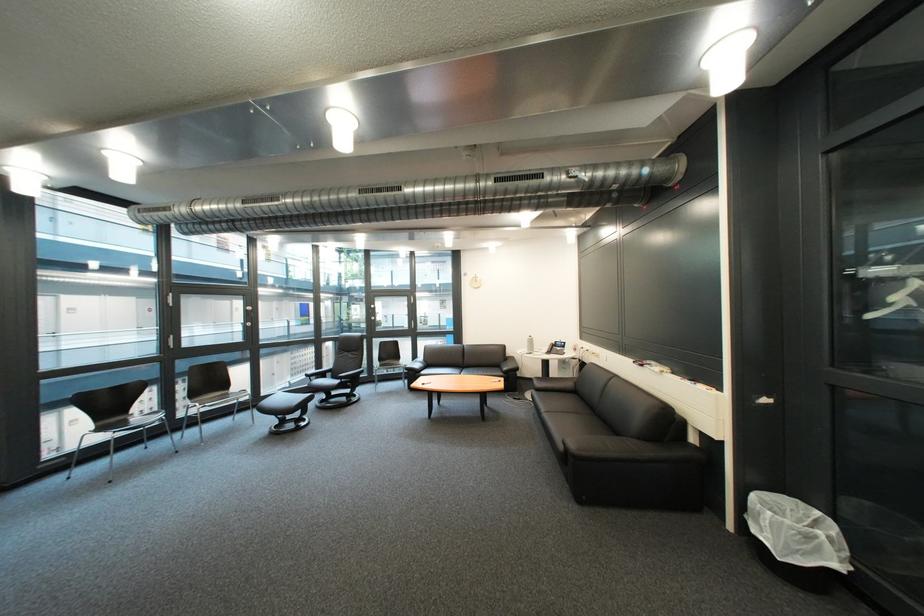
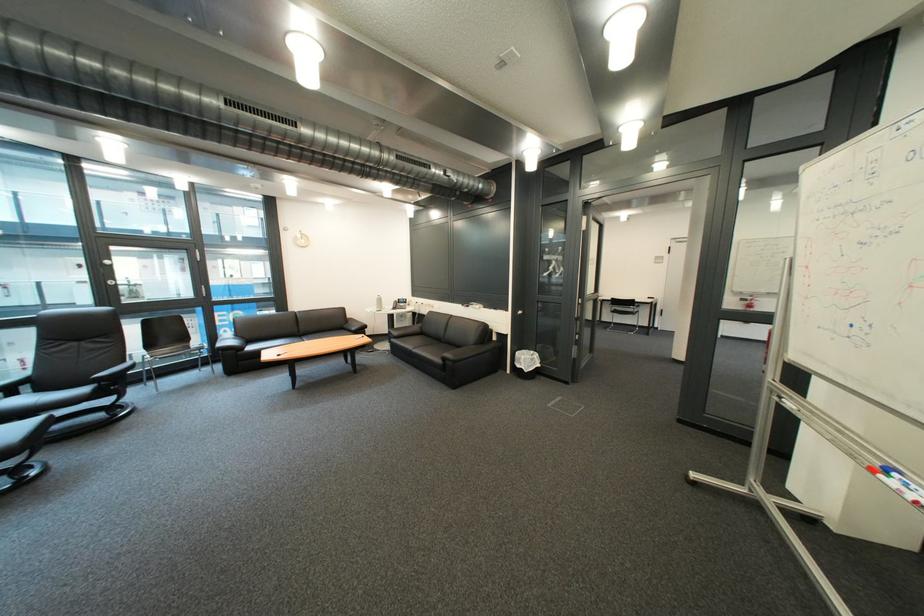
Find the pixel in the second image that matches (x=478, y=366) in the first image.

(312, 334)